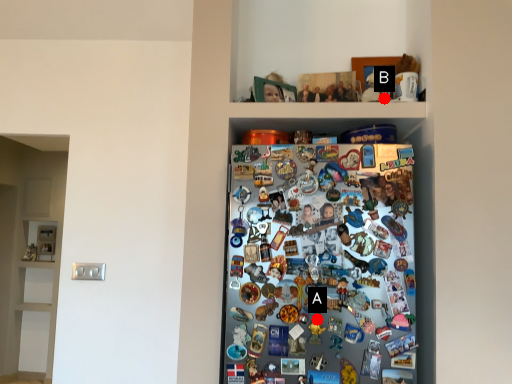
Question: Two points are circled on the image, labeled by A and B beside each circle. Which of the following is the closest to the observer?

Choices:
 (A) A is closer
 (B) B is closer

Answer: (A)